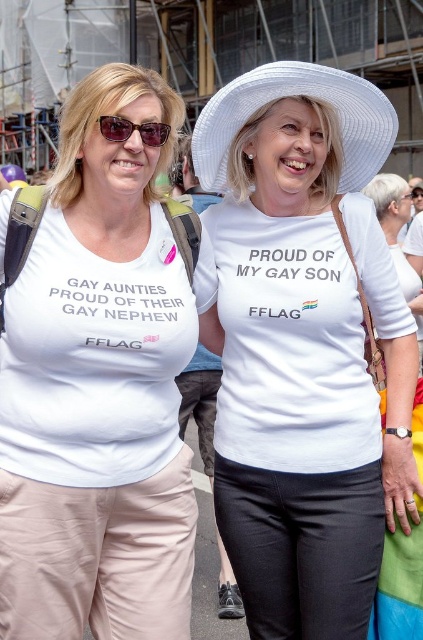
You are a photographer trying to focus on two points in the image. The first point is at coordinates point (82, 477) and the second is at point (351, 177). Which point should you focus on first to ensure the closest subject is sharp?

Point (82, 477) is closer to the viewer than point (351, 177), so you should focus on point (82, 477) first to ensure the closest subject is sharp.